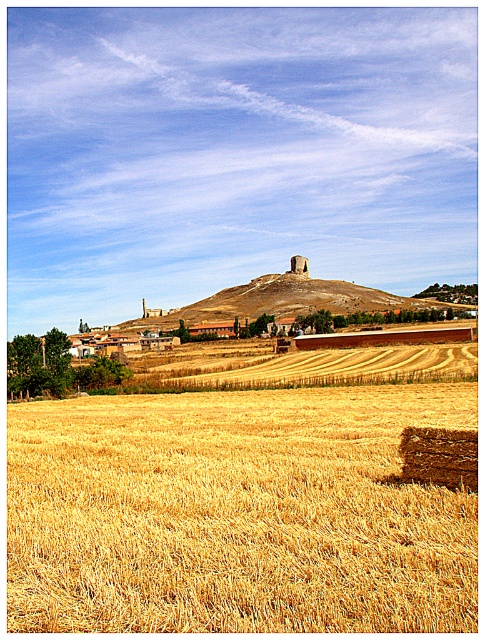
Between point (303, 557) and point (183, 378), which one is positioned in front?

Point (303, 557)

Is point (32, 449) closer to viewer compared to point (274, 381)?

Yes, point (32, 449) is closer to viewer.

Between point (142, 604) and point (365, 381), which one is positioned behind?

Positioned behind is point (365, 381).

The height and width of the screenshot is (640, 485). I want to click on golden straw bale at lower right, so (x=236, y=515).

Can you confirm if golden straw bale at center is smaller than smooth beige hill at center?

Correct, golden straw bale at center occupies less space than smooth beige hill at center.

Which is in front, point (355, 352) or point (220, 310)?

Positioned in front is point (355, 352).

Between point (309, 360) and point (388, 292), which one is positioned in front?

Point (309, 360) is more forward.

This screenshot has height=640, width=485. I want to click on golden straw bale at center, so click(325, 369).

Can you confirm if golden straw bale at lower right is smaller than smooth beige hill at center?

Yes, golden straw bale at lower right is smaller than smooth beige hill at center.

Measure the distance between golden straw bale at lower right and camera.

golden straw bale at lower right and camera are 6.21 meters apart.

This screenshot has height=640, width=485. I want to click on golden straw bale at lower right, so click(236, 515).